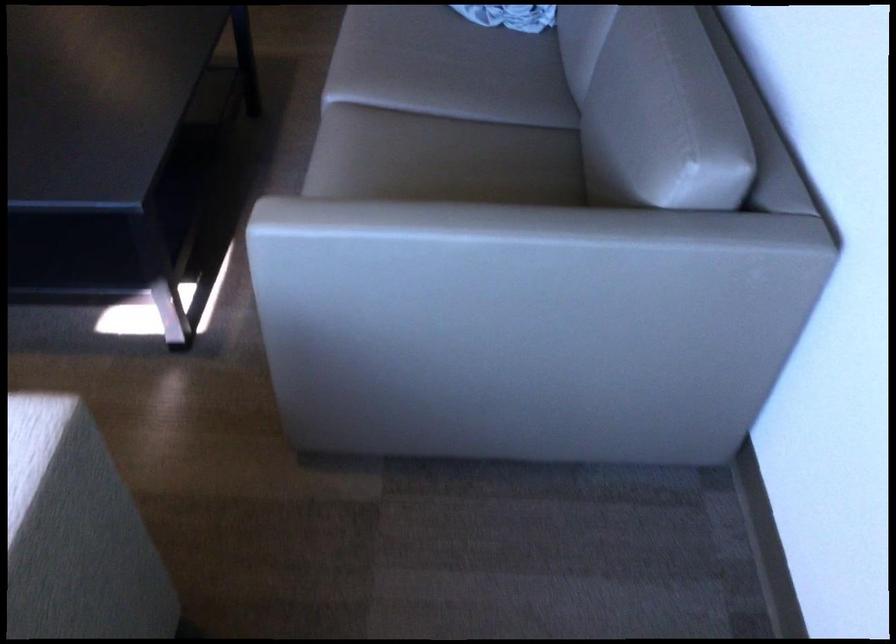
At what (x,y) coordinates should I click in order to perform the action: click on sofa sitting surface. Please return your answer as a coordinate pair (x, y). The height and width of the screenshot is (644, 896). Looking at the image, I should click on (463, 73).